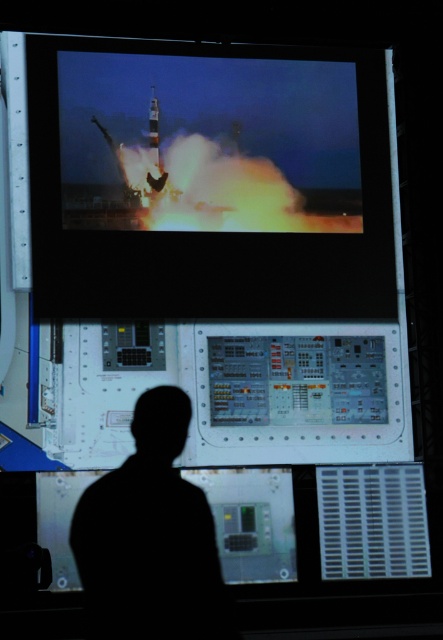
You are an astronaut in a spacecraft and see the black matte silhouette at center and the shiny metallic missile at upper center on your control panel. Which object is located to the left of the other?

The shiny metallic missile at upper center is located to the left of the black matte silhouette at center because the black matte silhouette at center is positioned on the right side of the shiny metallic missile at upper center.

You are an astronaut in the spacecraft control room. You see the matte black rocket at upper center and the black matte silhouette at center. Which object is positioned to the right side of the other?

The matte black rocket at upper center is to the right of the black matte silhouette at center.

You are an astronaut trying to locate the matte black rocket at upper center on the large screen. The screen has a coordinate grid with the origin at the bottom left corner. Can you determine the rocket is in the upper half of the screen?

The 2D location of matte black rocket at upper center is at point (209, 180). Since the y coordinate is 0.474 which is greater than 0.5 from the bottom, so the rocket is in the upper half of the screen.